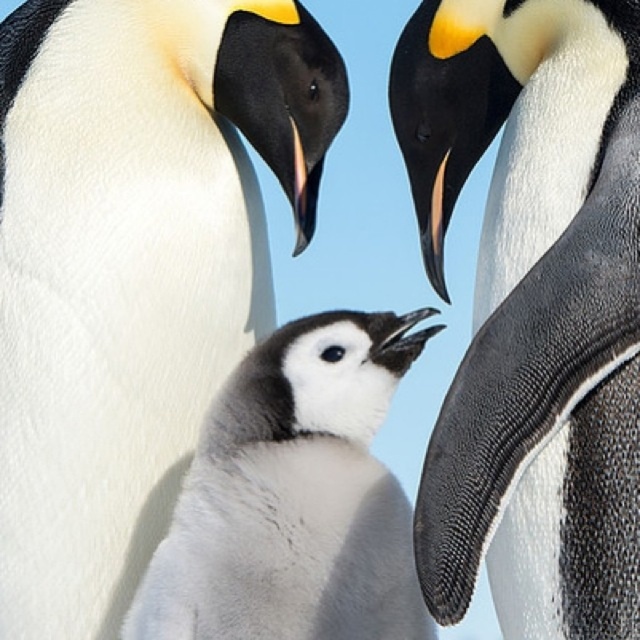
Question: Which object is the closest to the soft gray downy penguin chick at center?

Choices:
 (A) white matte penguin at center
 (B) white matte penguin chick at center

Answer: (A)

Question: Among these points, which one is farthest from the camera?

Choices:
 (A) (186, 317)
 (B) (326, 403)

Answer: (A)

Question: Can you confirm if white matte penguin chick at center is positioned to the left of white matte penguin at center?

Choices:
 (A) yes
 (B) no

Answer: (A)

Question: Does white matte penguin chick at center lie behind white matte penguin at center?

Choices:
 (A) no
 (B) yes

Answer: (B)

Question: In this image, where is white matte penguin chick at center located relative to white matte penguin at center?

Choices:
 (A) left
 (B) right

Answer: (A)

Question: Which of the following is the farthest from the observer?

Choices:
 (A) soft gray downy penguin chick at center
 (B) white matte penguin chick at center
 (C) white matte penguin at center

Answer: (B)